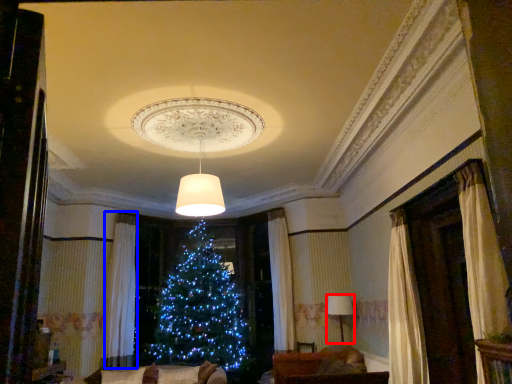
Question: Which of the following is the closest to the observer, lamp (highlighted by a red box) or curtain (highlighted by a blue box)?

Choices:
 (A) lamp
 (B) curtain

Answer: (A)